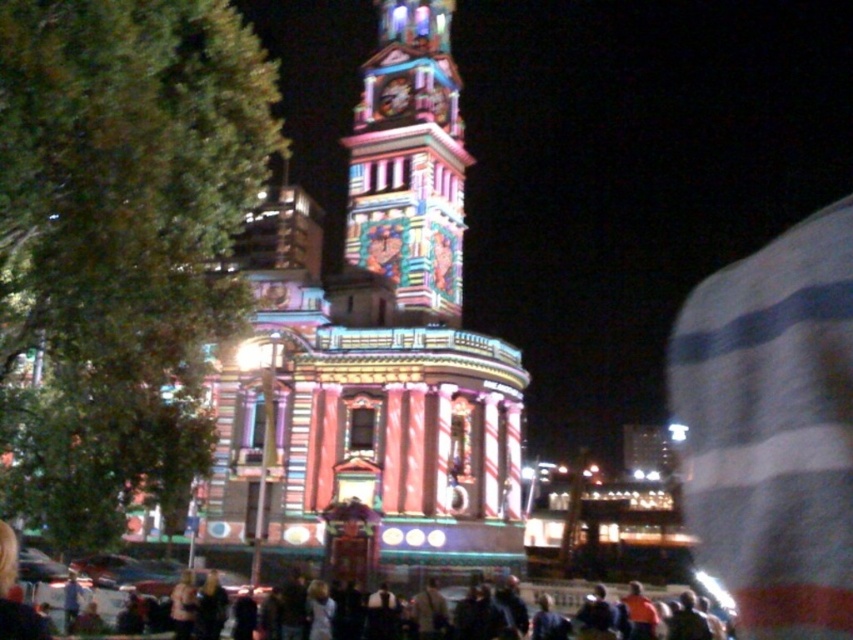
Between multicolored mosaic clock tower at center and dark clothing crowd at center, which one has more height?

multicolored mosaic clock tower at center

Can you confirm if multicolored mosaic clock tower at center is shorter than dark clothing crowd at center?

No, multicolored mosaic clock tower at center is not shorter than dark clothing crowd at center.

Locate an element on the screen. Image resolution: width=853 pixels, height=640 pixels. multicolored mosaic clock tower at center is located at coordinates (409, 161).

Can you confirm if multicolored illuminated tower at center is shorter than dark clothing crowd at center?

In fact, multicolored illuminated tower at center may be taller than dark clothing crowd at center.

Looking at this image, who is positioned more to the left, multicolored illuminated tower at center or dark clothing crowd at center?

multicolored illuminated tower at center

The height and width of the screenshot is (640, 853). In order to click on multicolored illuminated tower at center in this screenshot , I will do click(373, 349).

You are a GUI agent. You are given a task and a screenshot of the screen. Output one action in this format:
    pyautogui.click(x=<x>, y=<y>)
    Task: Click on the multicolored illuminated tower at center
    The width and height of the screenshot is (853, 640).
    Given the screenshot: What is the action you would take?
    pyautogui.click(x=373, y=349)

Is multicolored illuminated tower at center above multicolored mosaic clock tower at center?

Incorrect, multicolored illuminated tower at center is not positioned above multicolored mosaic clock tower at center.

Is multicolored illuminated tower at center smaller than multicolored mosaic clock tower at center?

No.

From the picture: Who is more forward, [405,417] or [398,196]?

Point [405,417] is more forward.

You are a GUI agent. You are given a task and a screenshot of the screen. Output one action in this format:
    pyautogui.click(x=<x>, y=<y>)
    Task: Click on the multicolored illuminated tower at center
    The image size is (853, 640).
    Given the screenshot: What is the action you would take?
    pyautogui.click(x=373, y=349)